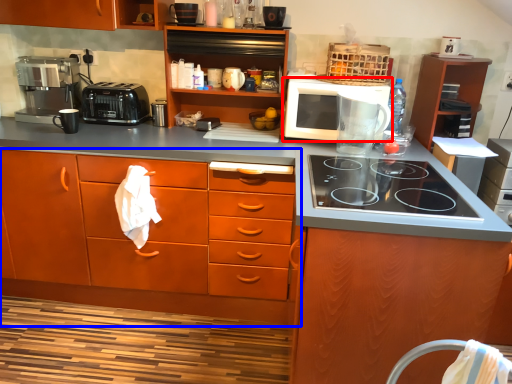
Question: Which point is closer to the camera, microwave oven (highlighted by a red box) or cabinetry (highlighted by a blue box)?

Choices:
 (A) microwave oven
 (B) cabinetry

Answer: (B)